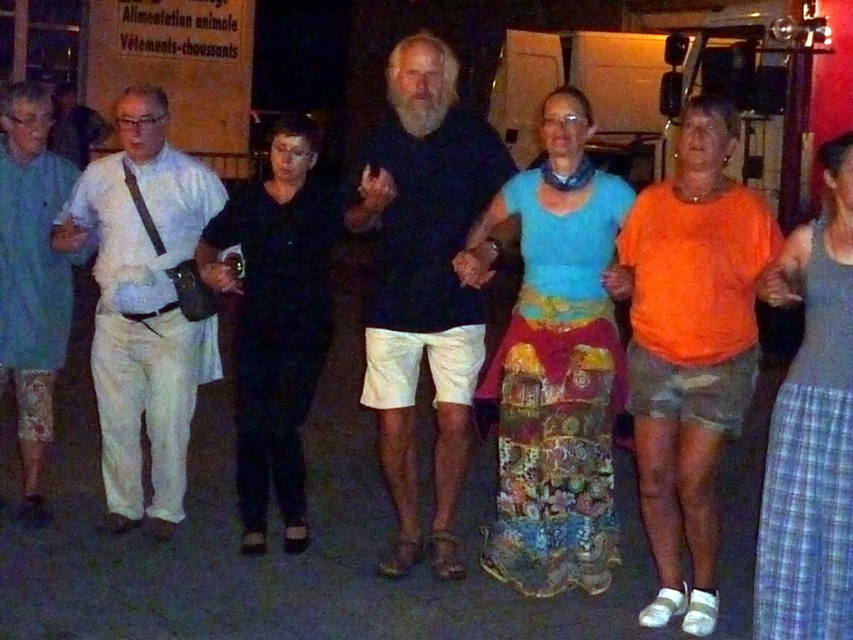
Consider the image. Which is more to the right, white cotton shirt at left or gray plaid skirt at lower right?

gray plaid skirt at lower right

Image resolution: width=853 pixels, height=640 pixels. I want to click on white cotton shirt at left, so click(142, 305).

In order to click on white cotton shirt at left in this screenshot , I will do `click(142, 305)`.

Locate an element on the screen. Image resolution: width=853 pixels, height=640 pixels. white cotton shirt at left is located at coordinates (142, 305).

Does point (554, 150) lie behind point (305, 410)?

That is False.

Looking at this image, between blue cotton shirt at center and black matte pants at center, which one appears on the left side from the viewer's perspective?

black matte pants at center

What do you see at coordinates (555, 364) in the screenshot?
I see `blue cotton shirt at center` at bounding box center [555, 364].

Where is `blue cotton shirt at center`? blue cotton shirt at center is located at coordinates (555, 364).

Which is more to the left, blue cotton shirt at center or light blue cotton shirt at left?

From the viewer's perspective, light blue cotton shirt at left appears more on the left side.

Does point (525, 438) come closer to viewer compared to point (24, 403)?

Yes, point (525, 438) is in front of point (24, 403).

You are a GUI agent. You are given a task and a screenshot of the screen. Output one action in this format:
    pyautogui.click(x=<x>, y=<y>)
    Task: Click on the blue cotton shirt at center
    The image size is (853, 640).
    Given the screenshot: What is the action you would take?
    pyautogui.click(x=555, y=364)